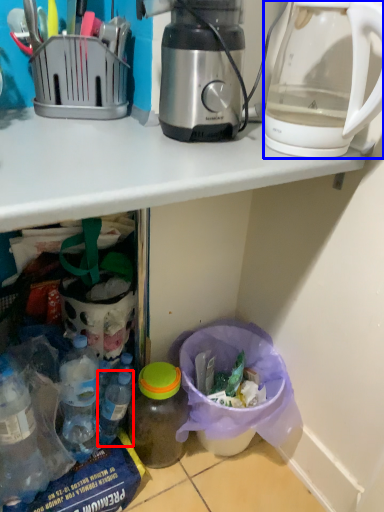
Question: Which of the following is the farthest to the observer, bottle (highlighted by a red box) or kettle (highlighted by a blue box)?

Choices:
 (A) bottle
 (B) kettle

Answer: (A)